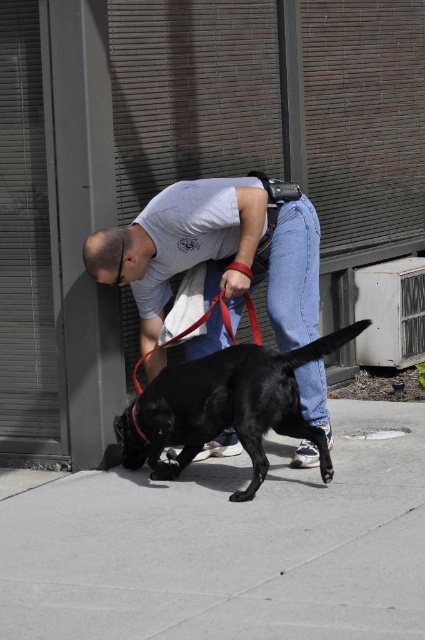
Which is behind, point (198, 484) or point (238, 436)?

Point (198, 484)

Can you confirm if smooth concrete sidewalk at lower center is wider than shiny black dog at center?

Indeed, smooth concrete sidewalk at lower center has a greater width compared to shiny black dog at center.

Identify the location of smooth concrete sidewalk at lower center. (229, 545).

Between shiny black dog at center and red nylon leash at lower center, which one has less height?

Standing shorter between the two is red nylon leash at lower center.

Can you confirm if shiny black dog at center is thinner than red nylon leash at lower center?

Incorrect, shiny black dog at center's width is not less than red nylon leash at lower center's.

Find the location of a particular element. This screenshot has height=640, width=425. shiny black dog at center is located at coordinates (224, 406).

Where is `shiny black dog at center`? shiny black dog at center is located at coordinates (224, 406).

From the picture: Between smooth concrete sidewalk at lower center and matte black shirt at center, which one is positioned lower?

smooth concrete sidewalk at lower center

Is smooth concrete sidewalk at lower center bigger than matte black shirt at center?

Correct, smooth concrete sidewalk at lower center is larger in size than matte black shirt at center.

The height and width of the screenshot is (640, 425). Find the location of `smooth concrete sidewalk at lower center`. smooth concrete sidewalk at lower center is located at coordinates (229, 545).

Find the location of a particular element. The height and width of the screenshot is (640, 425). smooth concrete sidewalk at lower center is located at coordinates (229, 545).